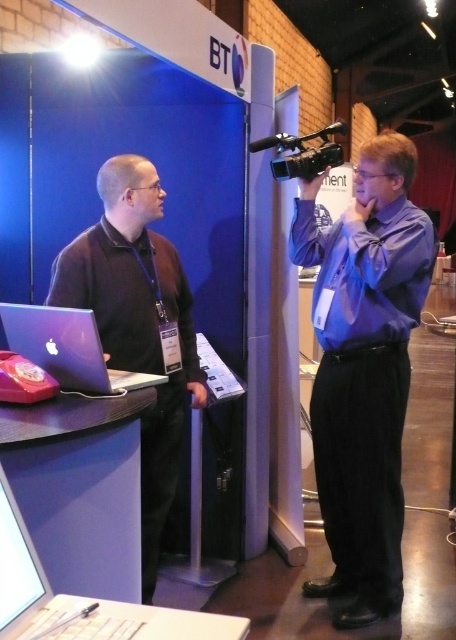
Question: Among these objects, which one is farthest from the camera?

Choices:
 (A) matte black laptop at left
 (B) blue smooth shirt at right
 (C) black plastic video camera at upper right
 (D) silver metallic laptop at lower left

Answer: (C)

Question: Which point is farther to the camera?

Choices:
 (A) (403, 413)
 (B) (125, 627)
 (C) (88, 364)

Answer: (A)

Question: Among these points, which one is farthest from the camera?

Choices:
 (A) (347, 616)
 (B) (273, 161)

Answer: (B)

Question: Is blue smooth shirt at right positioned before matte black laptop at left?

Choices:
 (A) no
 (B) yes

Answer: (A)

Question: Is matte black laptop at left in front of matte silver laptop at left?

Choices:
 (A) yes
 (B) no

Answer: (B)

Question: Considering the relative positions of matte black laptop at left and silver metallic laptop at lower left in the image provided, where is matte black laptop at left located with respect to silver metallic laptop at lower left?

Choices:
 (A) left
 (B) right

Answer: (A)